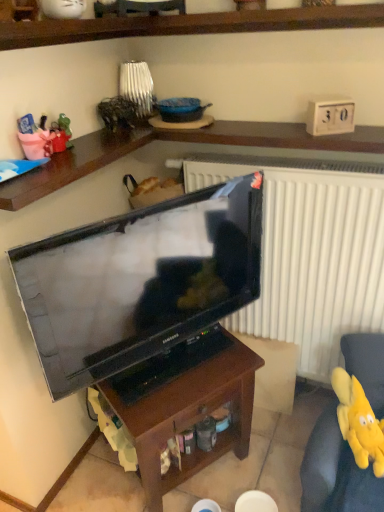
Measure the distance between point (377, 432) and camera.

Point (377, 432) is 1.38 meters away from camera.

Consider the image. Measure the distance between matte black television at center and camera.

A distance of 1.05 meters exists between matte black television at center and camera.

This screenshot has width=384, height=512. Describe the element at coordinates (139, 281) in the screenshot. I see `matte black television at center` at that location.

At what (x,y) coordinates should I click in order to perform the action: click on yellow plush toy at lower right. Please return your answer as a coordinate pair (x, y). Image resolution: width=384 pixels, height=512 pixels. Looking at the image, I should click on (336, 472).

Does point (369, 369) appear closer or farther from the camera than point (106, 395)?

Point (369, 369) appears to be farther away from the viewer than point (106, 395).

Is yellow plush toy at lower right facing towards brown wood table at center?

No, yellow plush toy at lower right is not facing towards brown wood table at center.

From the image's perspective, which one is positioned lower, yellow plush toy at lower right or brown wood table at center?

yellow plush toy at lower right.

Is yellow plush toy at lower right directly adjacent to brown wood table at center?

No.

From the image's perspective, is yellow plush toy at lower right above or below brown wood table at center?

Based on their image positions, yellow plush toy at lower right is located above brown wood table at center.

Does yellow plush toy at lower right have a greater width compared to brown wood table at center?

No, yellow plush toy at lower right is not wider than brown wood table at center.

Considering the sizes of objects yellow plush toy at lower right and brown wood table at center in the image provided, who is shorter, yellow plush toy at lower right or brown wood table at center?

yellow plush toy at lower right is shorter.

From the picture: What's the angular difference between yellow plush toy at lower right and yellow plush toy at lower right's facing directions?

yellow plush toy at lower right and yellow plush toy at lower right are facing 10.2 degrees away from each other.

Can you confirm if yellow plush toy at lower right is taller than yellow plush toy at lower right?

Yes, yellow plush toy at lower right is taller than yellow plush toy at lower right.

Between yellow plush toy at lower right and yellow plush toy at lower right, which one has smaller size?

yellow plush toy at lower right is smaller.

Is point (306, 502) closer or farther from the camera than point (358, 445)?

Point (306, 502) is farther from the camera than point (358, 445).

From the image's perspective, which is below, matte black television at center or brown wood table at center?

From the image's view, brown wood table at center is below.

Does matte black television at center appear on the left side of brown wood table at center?

Indeed, matte black television at center is positioned on the left side of brown wood table at center.

Is matte black television at center completely or partially outside of brown wood table at center?

Yes, matte black television at center is not within brown wood table at center.

Find the location of a particular element. television above the brown wood table at center (from a real-world perspective) is located at coordinates (139, 281).

Is brown wood table at center oriented away from matte black television at center?

Result: No.

Considering the sizes of objects brown wood table at center and matte black television at center in the image provided, who is wider, brown wood table at center or matte black television at center?

With larger width is brown wood table at center.

From a real-world perspective, which object stands above the other?

From a 3D spatial view, matte black television at center is above.

Could matte black television at center be considered to be inside brown wood table at center?

No, matte black television at center is not inside brown wood table at center.

The height and width of the screenshot is (512, 384). In order to click on toy below the matte black television at center (from a real-world perspective) in this screenshot , I will do `click(358, 422)`.

Would you consider yellow plush toy at lower right to be distant from matte black television at center?

No, there isn't a large distance between yellow plush toy at lower right and matte black television at center.

In the scene shown: Is matte black television at center at the back of yellow plush toy at lower right?

yellow plush toy at lower right does not have its back to matte black television at center.

Which is more to the left, yellow plush toy at lower right or matte black television at center?

Positioned to the left is matte black television at center.

This screenshot has height=512, width=384. In the image, there is a yellow plush toy at lower right. In order to click on table below it (from a real-world perspective) in this screenshot , I will do `click(187, 408)`.

Is brown wood table at center facing towards yellow plush toy at lower right?

No, brown wood table at center does not turn towards yellow plush toy at lower right.

Looking at their sizes, would you say brown wood table at center is wider or thinner than yellow plush toy at lower right?

Considering their sizes, brown wood table at center looks broader than yellow plush toy at lower right.

From a real-world perspective, is brown wood table at center physically located above or below yellow plush toy at lower right?

Clearly, from a real-world perspective, brown wood table at center is below yellow plush toy at lower right.

Find the location of a particular element. swivel chair located above the brown wood table at center (from a real-world perspective) is located at coordinates (336, 472).

The image size is (384, 512). I want to click on toy behind the brown wood table at center, so click(x=358, y=422).

Based on their spatial positions, is yellow plush toy at lower right or brown wood table at center closer to yellow plush toy at lower right?

yellow plush toy at lower right lies closer to yellow plush toy at lower right than the other object.

From the image, which object appears to be nearer to yellow plush toy at lower right, yellow plush toy at lower right or matte black television at center?

Based on the image, yellow plush toy at lower right appears to be nearer to yellow plush toy at lower right.

Based on their spatial positions, is matte black television at center or yellow plush toy at lower right closer to yellow plush toy at lower right?

yellow plush toy at lower right.

From the image, which object appears to be farther from matte black television at center, brown wood table at center or yellow plush toy at lower right?

yellow plush toy at lower right is positioned further to the anchor matte black television at center.

From the image, which object appears to be farther from yellow plush toy at lower right, yellow plush toy at lower right or matte black television at center?

The object further to yellow plush toy at lower right is matte black television at center.

Based on their spatial positions, is matte black television at center or yellow plush toy at lower right further from brown wood table at center?

yellow plush toy at lower right lies further to brown wood table at center than the other object.

Based on their spatial positions, is yellow plush toy at lower right or yellow plush toy at lower right further from matte black television at center?

yellow plush toy at lower right is positioned further to the anchor matte black television at center.

Which object lies further to the anchor point yellow plush toy at lower right, brown wood table at center or yellow plush toy at lower right?

brown wood table at center lies further to yellow plush toy at lower right than the other object.

Locate an element on the screen. swivel chair between brown wood table at center and yellow plush toy at lower right is located at coordinates (336, 472).

You are a GUI agent. You are given a task and a screenshot of the screen. Output one action in this format:
    pyautogui.click(x=<x>, y=<y>)
    Task: Click on the table located between matte black television at center and yellow plush toy at lower right in the left-right direction
    
    Given the screenshot: What is the action you would take?
    pyautogui.click(x=187, y=408)

Locate an element on the screen. This screenshot has height=512, width=384. table between matte black television at center and yellow plush toy at lower right in the horizontal direction is located at coordinates (187, 408).

Identify the location of swivel chair located between matte black television at center and yellow plush toy at lower right in the left-right direction. (336, 472).